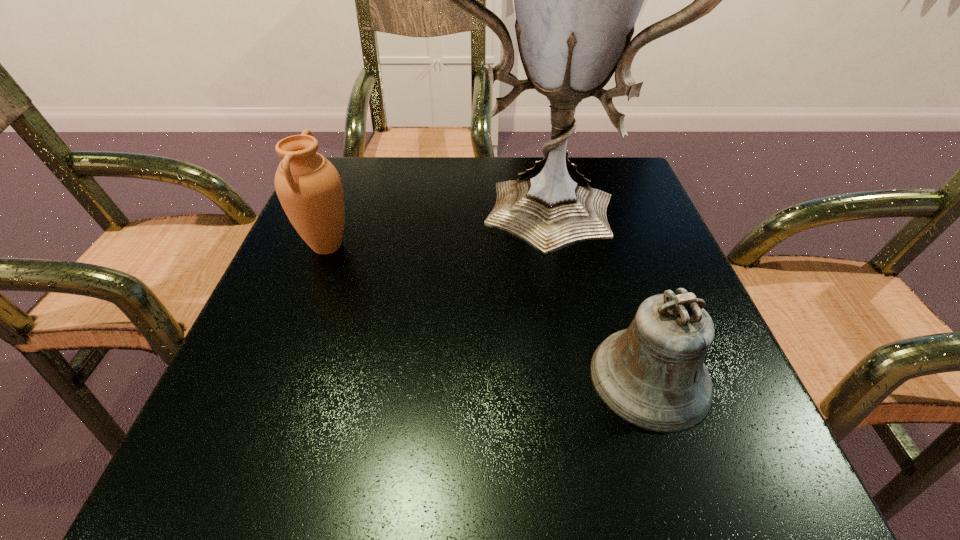
You are a GUI agent. You are given a task and a screenshot of the screen. Output one action in this format:
    pyautogui.click(x=<x>, y=<y>)
    Task: Click on the trophy cup
    Image resolution: width=960 pixels, height=540 pixels.
    Given the screenshot: What is the action you would take?
    pyautogui.click(x=577, y=0)

Identify the location of the second tallest object. (309, 188).

The image size is (960, 540). In order to click on the leftmost object in this screenshot , I will do `click(309, 188)`.

This screenshot has width=960, height=540. Find the location of `the nearest object`. the nearest object is located at coordinates (652, 375).

In order to click on bell in this screenshot , I will do `click(652, 375)`.

This screenshot has width=960, height=540. Identify the location of free space located 0.090m on the front of the trophy cup. (547, 302).

Where is `vacant space situated 0.230m on the back of the urn`? The height and width of the screenshot is (540, 960). vacant space situated 0.230m on the back of the urn is located at coordinates (357, 169).

Locate an element on the screen. free spot located 0.300m on the back of the bell is located at coordinates tap(599, 220).

Locate an element on the screen. object that is at the far edge is located at coordinates (577, 0).

At what (x,y) coordinates should I click in order to perform the action: click on object that is positioned at the near edge. Please return your answer as a coordinate pair (x, y). The height and width of the screenshot is (540, 960). Looking at the image, I should click on (652, 375).